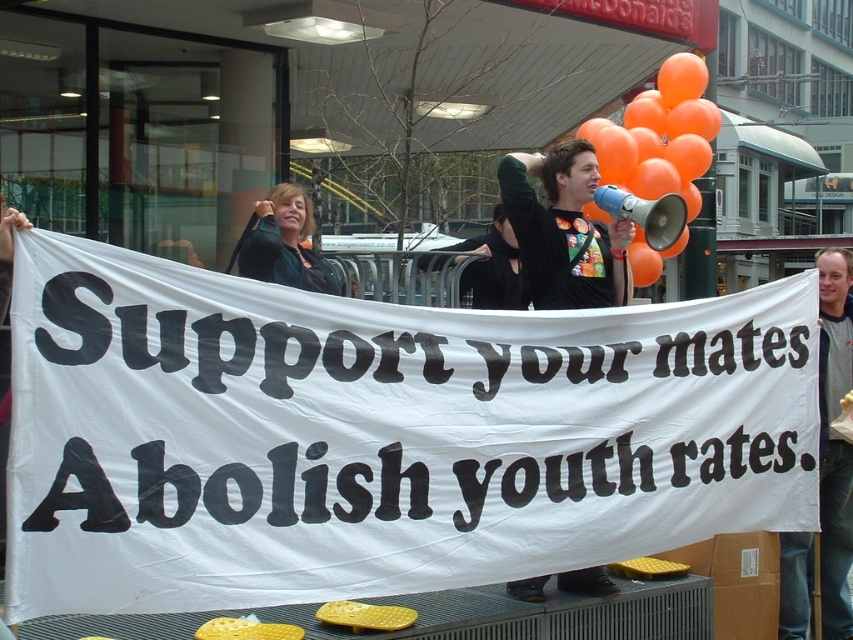
You are a photographer at the protest scene. You want to take a photo that includes both the white paper banner at center and the matte black jacket at upper center. Based on their positions, which object should appear higher in the photo?

The matte black jacket at upper center should appear higher in the photo because it is positioned above the white paper banner at center.

Consider the image. Looking at the protest scene, which object is bigger between the orange matte balloons at upper right and the matte black jacket at upper center?

The orange matte balloons at upper right has a larger size compared to the matte black jacket at upper center.